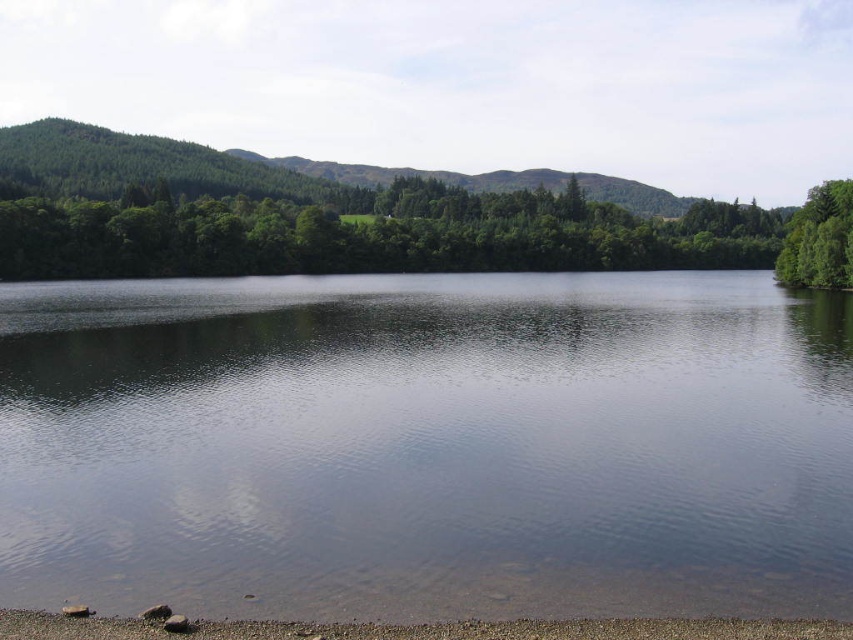
Question: Can you confirm if clear water at center is smaller than smooth pebbles at lower center?

Choices:
 (A) yes
 (B) no

Answer: (B)

Question: Which object appears farthest from the camera in this image?

Choices:
 (A) smooth pebbles at lower center
 (B) green leafy tree at upper center
 (C) clear water at center

Answer: (B)

Question: Does clear water at center have a greater width compared to green leafy tree at upper center?

Choices:
 (A) no
 (B) yes

Answer: (A)

Question: Which point appears closest to the camera in this image?

Choices:
 (A) (367, 634)
 (B) (596, 476)

Answer: (A)

Question: Is clear water at center to the right of smooth pebbles at lower center from the viewer's perspective?

Choices:
 (A) no
 (B) yes

Answer: (A)

Question: Which of the following is the farthest from the observer?

Choices:
 (A) clear water at center
 (B) green leafy tree at upper center

Answer: (B)